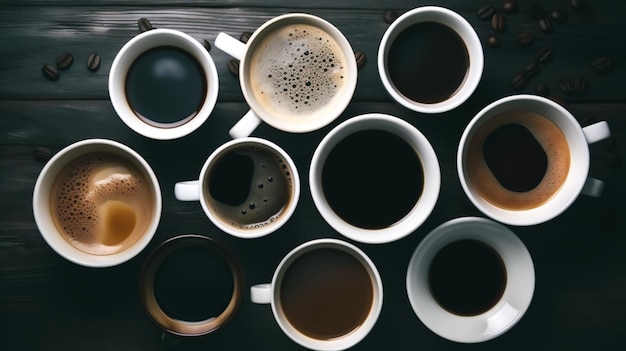
Where is `mug filled with coffee`? mug filled with coffee is located at coordinates (413, 75), (529, 142), (342, 164), (327, 100), (134, 67), (89, 208), (283, 188), (177, 310), (340, 313), (511, 288).